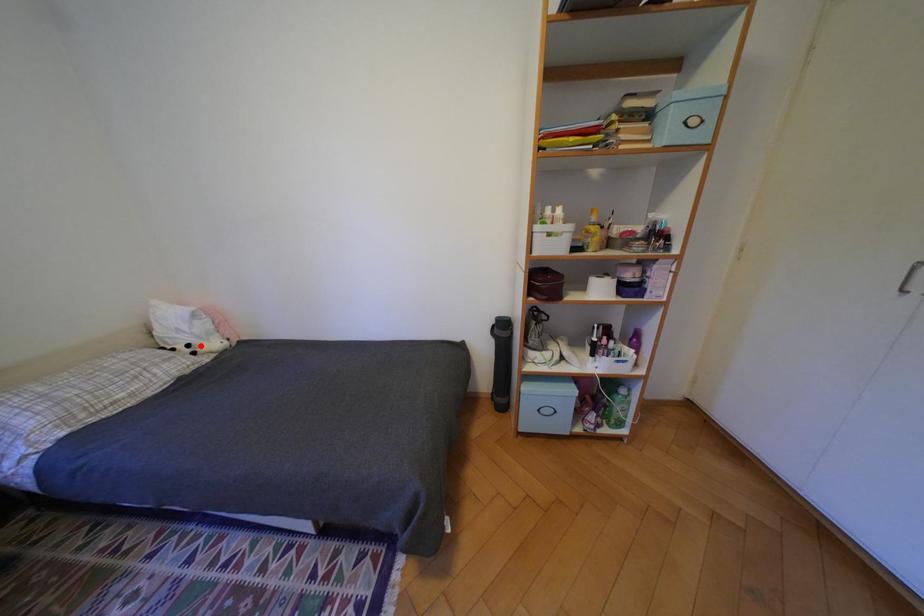
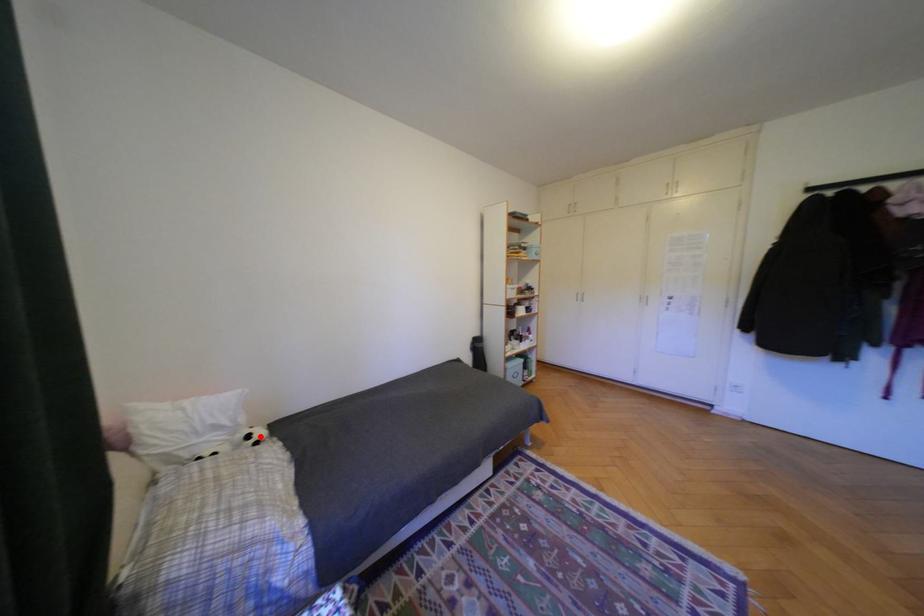
I am providing you with two images of the same scene from different viewpoints. A red point is marked on the first image and another point is marked on the second image. Does the point marked in image1 correspond to the same location as the one in image2?

Yes